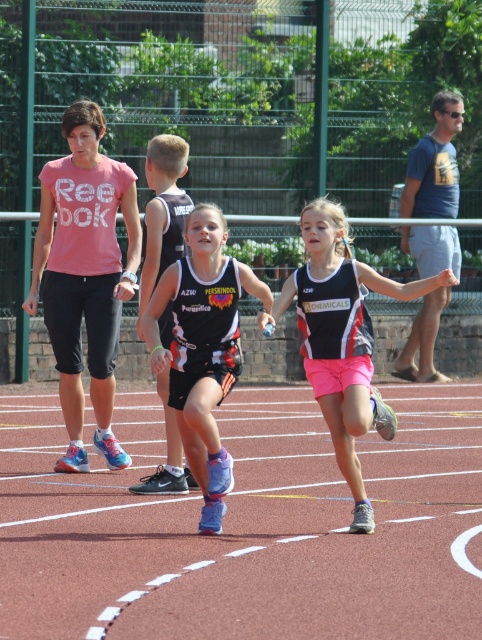
Question: Estimate the real-world distances between objects in this image. Which object is closer to the pink matte t-shirt at left?

Choices:
 (A) black jersey at center
 (B) matte black tank top at center

Answer: (A)

Question: Which of these objects is positioned closest to the pink matte t-shirt at left?

Choices:
 (A) black jersey at center
 (B) matte black tank top at center

Answer: (A)

Question: Does pink matte t-shirt at left lie behind black jersey at center?

Choices:
 (A) no
 (B) yes

Answer: (B)

Question: Considering the real-world distances, which object is closest to the pink matte t-shirt at left?

Choices:
 (A) matte black tank top at center
 (B) black jersey at center

Answer: (B)

Question: Is matte black tank top at center below black jersey at center?

Choices:
 (A) yes
 (B) no

Answer: (B)

Question: Does pink matte t-shirt at left have a lesser width compared to matte black tank top at center?

Choices:
 (A) no
 (B) yes

Answer: (B)